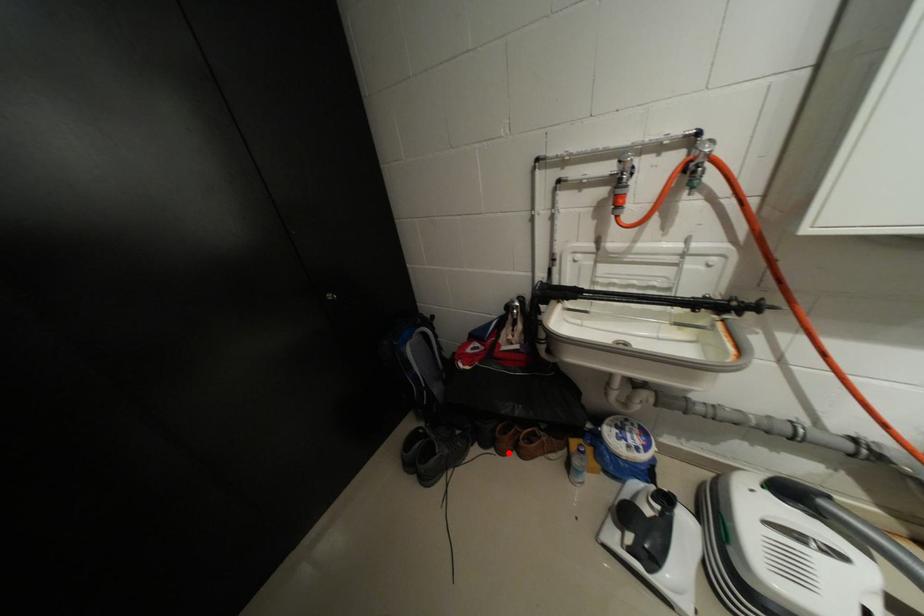
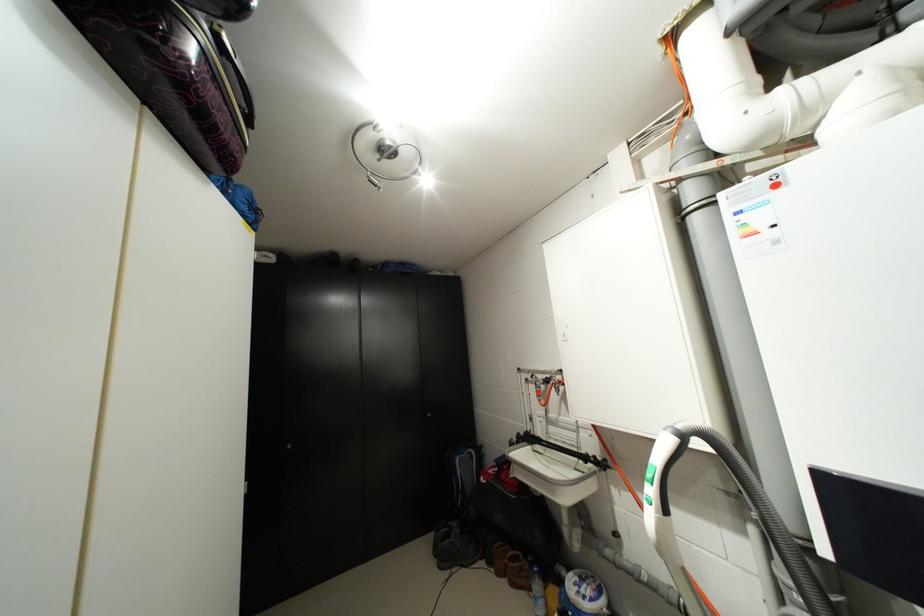
Where in the second image is the point corresponding to the highlighted location from the first image?

(505, 575)